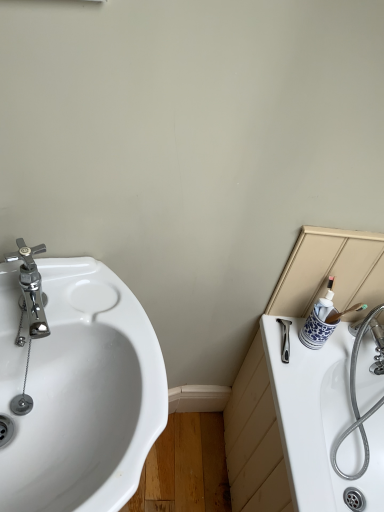
Question: Are white glossy sink at left and chrome/metallic faucet at left making contact?

Choices:
 (A) yes
 (B) no

Answer: (B)

Question: Can you confirm if white glossy sink at left is smaller than chrome/metallic faucet at left?

Choices:
 (A) yes
 (B) no

Answer: (B)

Question: Can you confirm if white glossy sink at left is positioned to the left of chrome/metallic faucet at left?

Choices:
 (A) yes
 (B) no

Answer: (B)

Question: From the image's perspective, is white glossy sink at left located beneath chrome/metallic faucet at left?

Choices:
 (A) yes
 (B) no

Answer: (A)

Question: Can you confirm if white glossy sink at left is shorter than chrome/metallic faucet at left?

Choices:
 (A) yes
 (B) no

Answer: (B)

Question: Could chrome/metallic faucet at left be considered to be inside white glossy sink at left?

Choices:
 (A) no
 (B) yes

Answer: (B)

Question: Does white glossy sink at left turn towards white ceramic bath at right?

Choices:
 (A) yes
 (B) no

Answer: (B)

Question: Is white glossy sink at left not inside white ceramic bath at right?

Choices:
 (A) yes
 (B) no

Answer: (A)

Question: Considering the relative sizes of white glossy sink at left and white ceramic bath at right in the image provided, is white glossy sink at left smaller than white ceramic bath at right?

Choices:
 (A) yes
 (B) no

Answer: (B)

Question: Is white glossy sink at left positioned with its back to white ceramic bath at right?

Choices:
 (A) yes
 (B) no

Answer: (B)

Question: Is the depth of white glossy sink at left less than that of white ceramic bath at right?

Choices:
 (A) yes
 (B) no

Answer: (A)

Question: Is white glossy sink at left at the left side of white ceramic bath at right?

Choices:
 (A) no
 (B) yes

Answer: (B)

Question: Is chrome/metallic faucet at left to the right of white glossy sink at left from the viewer's perspective?

Choices:
 (A) no
 (B) yes

Answer: (A)